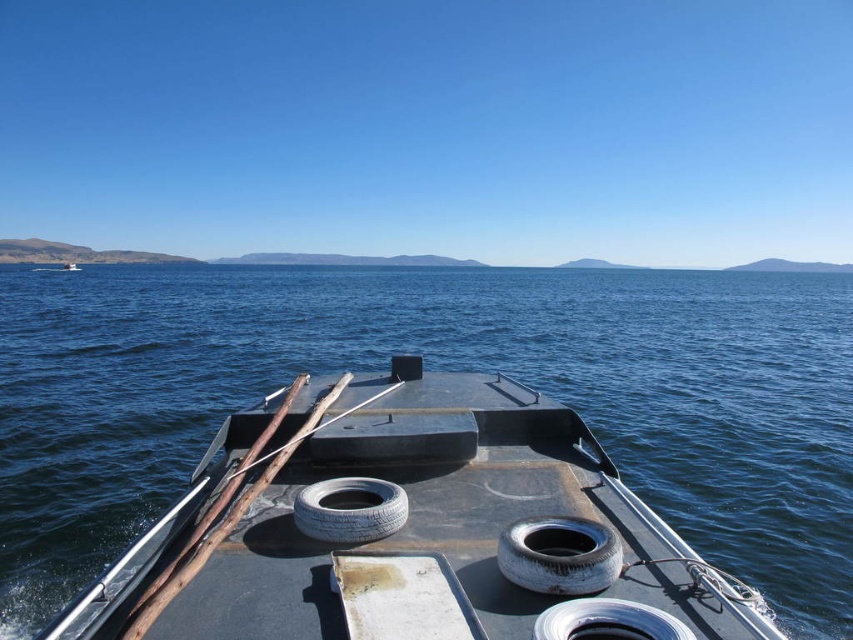
Who is more forward, (434, 515) or (311, 531)?

Point (311, 531) is in front.

What do you see at coordinates (397, 531) in the screenshot? I see `rusty metal boat at center` at bounding box center [397, 531].

The image size is (853, 640). Identify the location of rusty metal boat at center. (397, 531).

Can you confirm if white rubber tire at center is shorter than silver metallic tire at lower center?

In fact, white rubber tire at center may be taller than silver metallic tire at lower center.

Locate an element on the screen. This screenshot has width=853, height=640. white rubber tire at center is located at coordinates (349, 509).

Locate an element on the screen. This screenshot has height=640, width=853. white rubber tire at center is located at coordinates (349, 509).

Which is below, rusty metal boat at center or worn rubber tire at center?

worn rubber tire at center is lower down.

Who is more forward, (x=190, y=560) or (x=550, y=529)?

Point (x=190, y=560) is more forward.

Who is more forward, (462, 506) or (531, 540)?

Point (531, 540)

At what (x,y) coordinates should I click in order to perform the action: click on rusty metal boat at center. Please return your answer as a coordinate pair (x, y). This screenshot has height=640, width=853. Looking at the image, I should click on (397, 531).